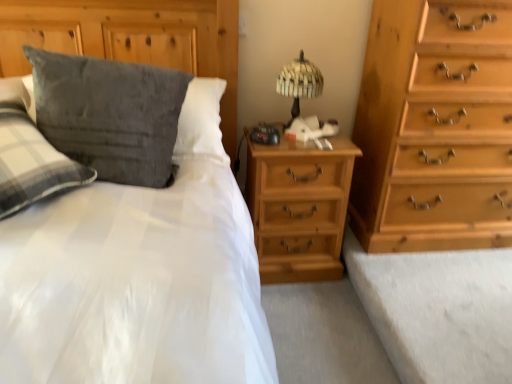
Find the location of a particular element. The image size is (512, 384). light brown wooden chest of drawers at right is located at coordinates (434, 128).

What do you see at coordinates (137, 227) in the screenshot?
I see `suede-like gray pillow at upper left` at bounding box center [137, 227].

You are a GUI agent. You are given a task and a screenshot of the screen. Output one action in this format:
    pyautogui.click(x=<x>, y=<y>)
    Task: Click on the light brown wooden chest of drawers at right
    This screenshot has width=512, height=384.
    Given the screenshot: What is the action you would take?
    pyautogui.click(x=434, y=128)

Measure the distance between light brown wooden chest of drawers at right and velvety gray pillow at upper left.

A distance of 1.07 meters exists between light brown wooden chest of drawers at right and velvety gray pillow at upper left.

From the image's perspective, relative to velvety gray pillow at upper left, is light brown wooden chest of drawers at right above or below?

Clearly, from the image's perspective, light brown wooden chest of drawers at right is above velvety gray pillow at upper left.

Does light brown wooden chest of drawers at right appear on the right side of velvety gray pillow at upper left?

Indeed, light brown wooden chest of drawers at right is positioned on the right side of velvety gray pillow at upper left.

Looking at the image, does light brown wooden chest of drawers at right seem bigger or smaller compared to velvety gray pillow at upper left?

light brown wooden chest of drawers at right is bigger than velvety gray pillow at upper left.

Which point is more forward, (312, 167) or (228, 256)?

Point (228, 256)

Between light brown wood nightstand at center and suede-like gray pillow at upper left, which one has less height?

light brown wood nightstand at center is shorter.

From a real-world perspective, is light brown wood nightstand at center positioned above or below suede-like gray pillow at upper left?

From a real-world perspective, light brown wood nightstand at center is physically below suede-like gray pillow at upper left.

From the picture: What's the angular difference between velvety gray pillow at upper left and light brown wooden chest of drawers at right's facing directions?

There is a 5.44-degree angle between the facing directions of velvety gray pillow at upper left and light brown wooden chest of drawers at right.

From a real-world perspective, is velvety gray pillow at upper left on top of light brown wooden chest of drawers at right?

Indeed, from a real-world perspective, velvety gray pillow at upper left stands above light brown wooden chest of drawers at right.

Considering the positions of objects velvety gray pillow at upper left and light brown wooden chest of drawers at right in the image provided, who is in front, velvety gray pillow at upper left or light brown wooden chest of drawers at right?

velvety gray pillow at upper left.

Is velvety gray pillow at upper left positioned beyond the bounds of light brown wooden chest of drawers at right?

velvety gray pillow at upper left lies outside light brown wooden chest of drawers at right's area.

Between point (96, 99) and point (248, 265), which one is positioned behind?

The point (248, 265) is farther.

Can you confirm if velvety gray pillow at upper left is shorter than suede-like gray pillow at upper left?

Correct, velvety gray pillow at upper left is not as tall as suede-like gray pillow at upper left.

Considering the relative sizes of velvety gray pillow at upper left and suede-like gray pillow at upper left in the image provided, is velvety gray pillow at upper left smaller than suede-like gray pillow at upper left?

Indeed, velvety gray pillow at upper left has a smaller size compared to suede-like gray pillow at upper left.

Is velvety gray pillow at upper left closer to the viewer compared to suede-like gray pillow at upper left?

Yes, velvety gray pillow at upper left is closer to the camera.

Based on the photo, from the image's perspective, is light brown wood nightstand at center beneath woven wood table lamp at upper center?

Indeed, from the image's perspective, light brown wood nightstand at center is shown beneath woven wood table lamp at upper center.

Does light brown wood nightstand at center turn towards woven wood table lamp at upper center?

No, light brown wood nightstand at center is not oriented towards woven wood table lamp at upper center.

From the picture: Which of these two, light brown wood nightstand at center or woven wood table lamp at upper center, stands taller?

light brown wood nightstand at center is taller.

Is velvety gray pillow at upper left at the back of woven wood table lamp at upper center?

No, woven wood table lamp at upper center's orientation is not away from velvety gray pillow at upper left.

Is woven wood table lamp at upper center directly adjacent to velvety gray pillow at upper left?

No.

Is woven wood table lamp at upper center not within velvety gray pillow at upper left?

woven wood table lamp at upper center lies outside velvety gray pillow at upper left's area.

Who is taller, woven wood table lamp at upper center or velvety gray pillow at upper left?

With more height is velvety gray pillow at upper left.

Looking at this image, which object is further away from the camera, woven wood table lamp at upper center or suede-like gray pillow at upper left?

woven wood table lamp at upper center is more distant.

Could suede-like gray pillow at upper left be considered to be inside woven wood table lamp at upper center?

No.

From their relative heights in the image, would you say woven wood table lamp at upper center is taller or shorter than suede-like gray pillow at upper left?

In the image, woven wood table lamp at upper center appears to be shorter than suede-like gray pillow at upper left.

In order to click on chest of drawers above the velvety gray pillow at upper left (from the image's perspective) in this screenshot , I will do `click(434, 128)`.

Identify the location of bed located above the light brown wood nightstand at center (from a real-world perspective). (137, 227).

When comparing their distances from woven wood table lamp at upper center, does light brown wooden chest of drawers at right or light brown wood nightstand at center seem closer?

light brown wood nightstand at center is positioned closer to the anchor woven wood table lamp at upper center.

Based on their spatial positions, is light brown wooden chest of drawers at right or woven wood table lamp at upper center closer to light brown wood nightstand at center?

light brown wooden chest of drawers at right is closer to light brown wood nightstand at center.

Based on their spatial positions, is velvety gray pillow at upper left or light brown wood nightstand at center closer to woven wood table lamp at upper center?

light brown wood nightstand at center is closer to woven wood table lamp at upper center.

Looking at the image, which one is located closer to woven wood table lamp at upper center, suede-like gray pillow at upper left or light brown wood nightstand at center?

light brown wood nightstand at center is closer to woven wood table lamp at upper center.

When comparing their distances from suede-like gray pillow at upper left, does light brown wooden chest of drawers at right or woven wood table lamp at upper center seem further?

Among the two, light brown wooden chest of drawers at right is located further to suede-like gray pillow at upper left.

From the image, which object appears to be nearer to light brown wood nightstand at center, light brown wooden chest of drawers at right or velvety gray pillow at upper left?

light brown wooden chest of drawers at right is positioned closer to the anchor light brown wood nightstand at center.

Considering their positions, is woven wood table lamp at upper center positioned closer to light brown wood nightstand at center than light brown wooden chest of drawers at right?

light brown wooden chest of drawers at right is positioned closer to the anchor light brown wood nightstand at center.

Considering their positions, is woven wood table lamp at upper center positioned further to suede-like gray pillow at upper left than light brown wooden chest of drawers at right?

Among the two, light brown wooden chest of drawers at right is located further to suede-like gray pillow at upper left.

Find the location of `nightstand between suede-like gray pillow at upper left and woven wood table lamp at upper center from left to right`. nightstand between suede-like gray pillow at upper left and woven wood table lamp at upper center from left to right is located at coordinates (298, 207).

This screenshot has width=512, height=384. I want to click on table lamp between suede-like gray pillow at upper left and light brown wooden chest of drawers at right from left to right, so click(298, 83).

Where is `nightstand between velvety gray pillow at upper left and light brown wooden chest of drawers at right from left to right`? This screenshot has height=384, width=512. nightstand between velvety gray pillow at upper left and light brown wooden chest of drawers at right from left to right is located at coordinates (x=298, y=207).

This screenshot has width=512, height=384. Identify the location of bed between velvety gray pillow at upper left and woven wood table lamp at upper center in the horizontal direction. (137, 227).